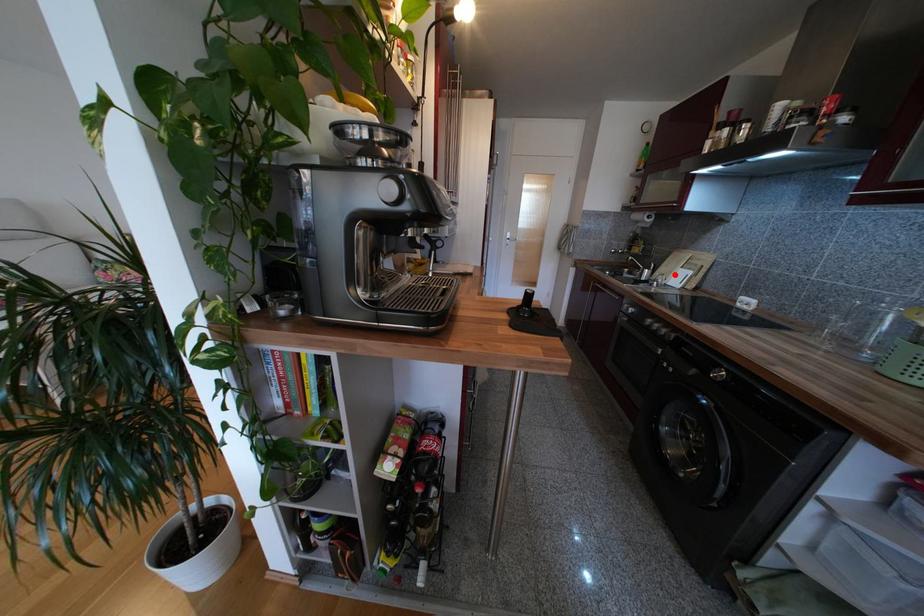
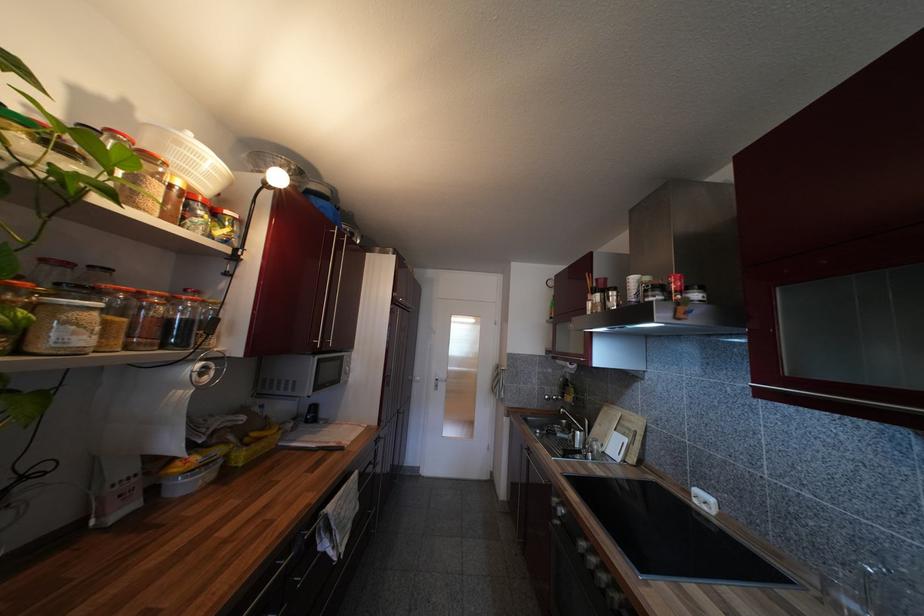
The point at the highlighted location is marked in the first image. Where is the corresponding point in the second image?

(610, 438)